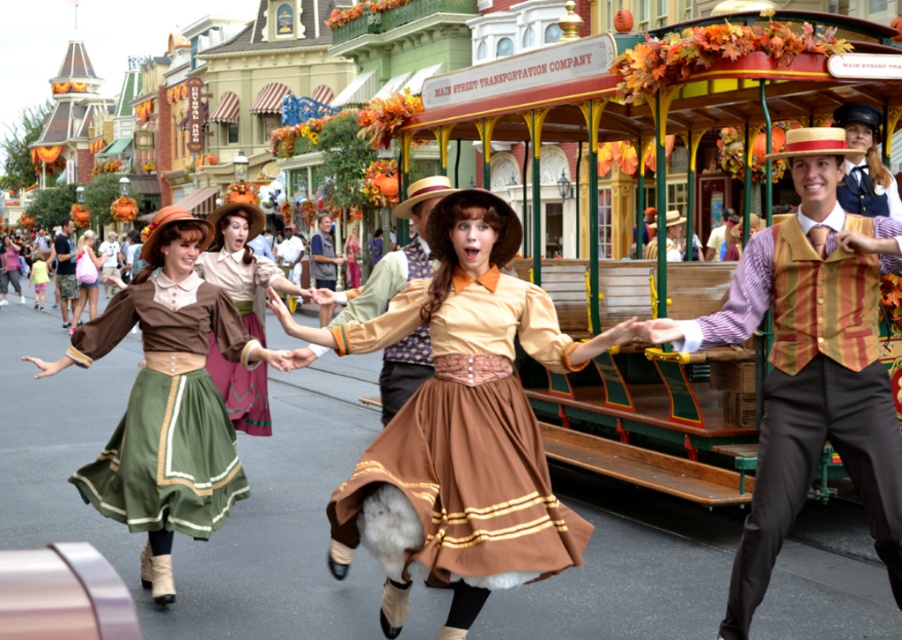
What do you see at coordinates (810, 365) in the screenshot? This screenshot has width=902, height=640. I see `striped vest at center` at bounding box center [810, 365].

What are the coordinates of `striped vest at center` in the screenshot? It's located at (810, 365).

At what (x,y) coordinates should I click in order to perform the action: click on striped vest at center. Please return your answer as a coordinate pair (x, y). Image resolution: width=902 pixels, height=640 pixels. Looking at the image, I should click on (810, 365).

Is green satin skirt at left to the right of matte brown vest at left from the viewer's perspective?

Yes, green satin skirt at left is to the right of matte brown vest at left.

The height and width of the screenshot is (640, 902). What do you see at coordinates (166, 413) in the screenshot?
I see `green satin skirt at left` at bounding box center [166, 413].

The image size is (902, 640). I want to click on green satin skirt at left, so click(166, 413).

Can you confirm if brown cotton skirt at center is shorter than matte brown dress at center?

Yes.

Who is positioned more to the right, brown cotton skirt at center or matte brown dress at center?

brown cotton skirt at center

Is point (426, 385) closer to viewer compared to point (84, 234)?

That is True.

Identify the location of brown cotton skirt at center. Image resolution: width=902 pixels, height=640 pixels. (465, 420).